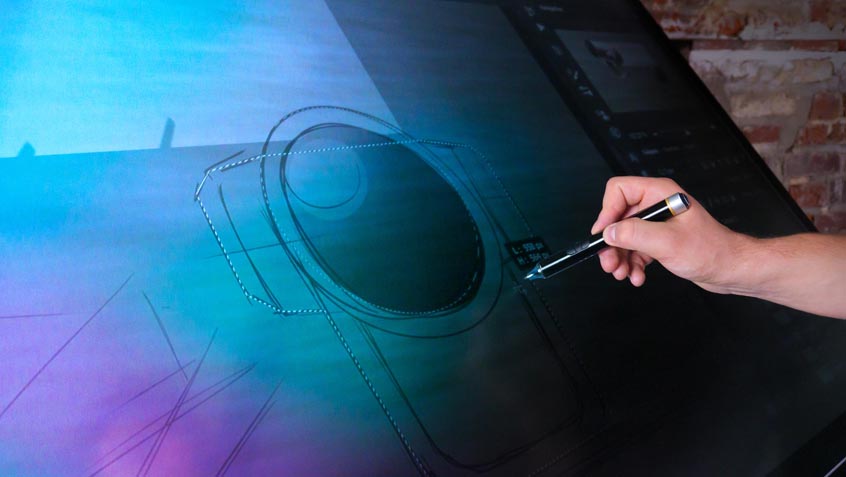
Where is `pen`? The image size is (846, 477). pen is located at coordinates (573, 253).